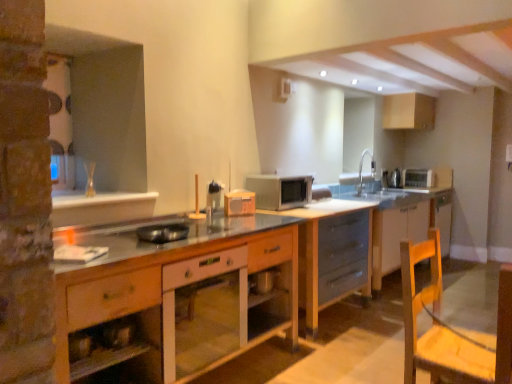
Question: In the image, is wooden swivel chair at lower right positioned in front of or behind silver metallic toaster at upper right, which appears as the 4th appliance when viewed from the left?

Choices:
 (A) front
 (B) behind

Answer: (A)

Question: Looking at the image, does wooden swivel chair at lower right seem bigger or smaller compared to silver metallic toaster at upper right, the first appliance when ordered from right to left?

Choices:
 (A) small
 (B) big

Answer: (B)

Question: Estimate the real-world distances between objects in this image. Which object is farther from the matte white cabinet at upper right, the fourth cabinetry viewed from the front?

Choices:
 (A) metallic silver toaster at upper right, positioned as the 2th appliance in back-to-front order
 (B) metallic silver pan at center, the 1th appliance positioned from the front
 (C) matte gray cabinet at center, which is counted as the third cabinetry, starting from the front
 (D) wooden cabinet at center, which ranks as the fourth cabinetry in right-to-left order
 (E) wooden swivel chair at lower right

Answer: (B)

Question: Which of these objects is positioned closest to the silver metallic faucet at upper right?

Choices:
 (A) metallic silver pan at center, the 1th appliance positioned from the front
 (B) wooden swivel chair at lower right
 (C) white glossy cabinet at center, acting as the 3th cabinetry starting from the right
 (D) satin silver microwave at center
 (E) matte gray cabinet at center, which is counted as the third cabinetry, starting from the front

Answer: (E)